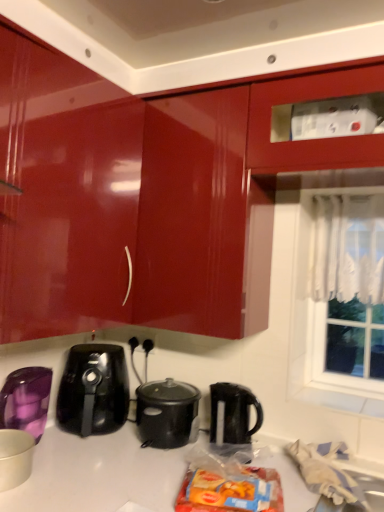
Identify the location of free region under white lace curtain at right (from a real-world perspective). The image size is (384, 512). (335, 395).